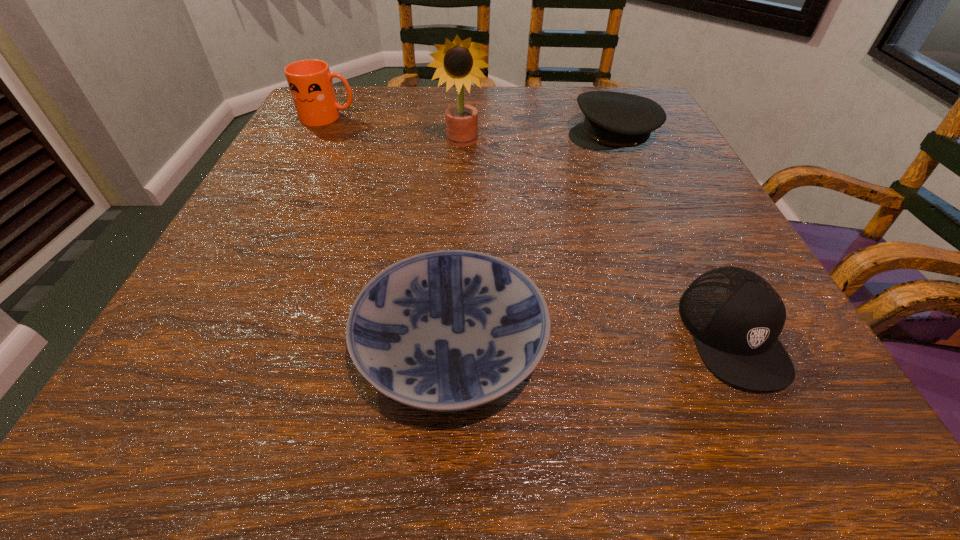
Where is `object present at the far left corner`? This screenshot has width=960, height=540. object present at the far left corner is located at coordinates (310, 82).

In order to click on object at the far right corner in this screenshot , I will do `click(613, 120)`.

This screenshot has height=540, width=960. I want to click on object that is at the near right corner, so click(x=735, y=316).

Identify the location of vacant position at the far edge of the desktop. (510, 95).

Locate an element on the screen. vacant space at the near edge of the desktop is located at coordinates (678, 387).

What are the coordinates of `free space at the left edge of the desktop` in the screenshot? It's located at (309, 180).

Where is `free space at the right edge of the desktop`? The height and width of the screenshot is (540, 960). free space at the right edge of the desktop is located at coordinates (792, 328).

Identify the location of blank space at the near left corner of the desktop. The width and height of the screenshot is (960, 540). (190, 444).

Identify the location of free area in between the mug and the shortest object. (390, 232).

Locate an element on the screen. The height and width of the screenshot is (540, 960). unoccupied area between the plate and the sunflower is located at coordinates pos(457,244).